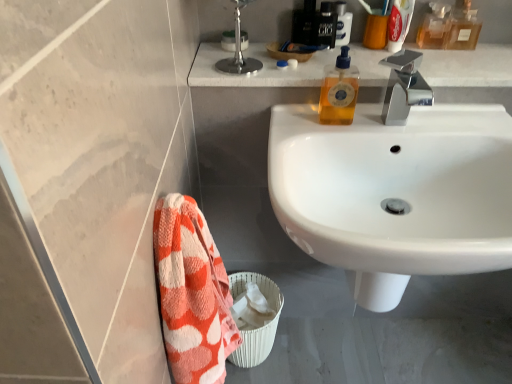
The height and width of the screenshot is (384, 512). I want to click on vacant space situated on the left part of polished chrome faucet at upper right, so click(x=331, y=125).